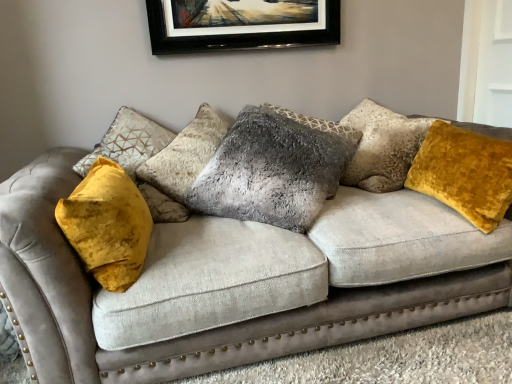
Question: Is fuzzy gray pillow at center, marked as the second pillow in a right-to-left arrangement, shorter than velvet gray couch at center?

Choices:
 (A) yes
 (B) no

Answer: (A)

Question: Does fuzzy gray pillow at center, marked as the second pillow in a right-to-left arrangement, have a lesser width compared to velvet gray couch at center?

Choices:
 (A) no
 (B) yes

Answer: (B)

Question: From a real-world perspective, does fuzzy gray pillow at center, marked as the second pillow in a right-to-left arrangement, sit lower than velvet gray couch at center?

Choices:
 (A) yes
 (B) no

Answer: (B)

Question: Could you tell me if fuzzy gray pillow at center, arranged as the 1th pillow when viewed from the left, is turned towards velvet gray couch at center?

Choices:
 (A) no
 (B) yes

Answer: (B)

Question: Is the position of fuzzy gray pillow at center, marked as the second pillow in a right-to-left arrangement, more distant than that of velvet gray couch at center?

Choices:
 (A) no
 (B) yes

Answer: (B)

Question: Is velvet gray couch at center completely or partially inside fuzzy gray pillow at center, marked as the second pillow in a right-to-left arrangement?

Choices:
 (A) yes
 (B) no

Answer: (B)

Question: Is velvet yellow pillow at right, which ranks as the 2th pillow in left-to-right order, far away from fuzzy gray pillow at center, arranged as the 1th pillow when viewed from the left?

Choices:
 (A) no
 (B) yes

Answer: (A)

Question: Is velvet yellow pillow at right, which ranks as the 2th pillow in left-to-right order, smaller than fuzzy gray pillow at center, marked as the second pillow in a right-to-left arrangement?

Choices:
 (A) no
 (B) yes

Answer: (B)

Question: Is velvet yellow pillow at right, placed as the first pillow when sorted from right to left, bigger than fuzzy gray pillow at center, arranged as the 1th pillow when viewed from the left?

Choices:
 (A) yes
 (B) no

Answer: (B)

Question: Can you confirm if velvet yellow pillow at right, placed as the first pillow when sorted from right to left, is wider than fuzzy gray pillow at center, marked as the second pillow in a right-to-left arrangement?

Choices:
 (A) no
 (B) yes

Answer: (A)

Question: Does velvet yellow pillow at right, placed as the first pillow when sorted from right to left, lie behind fuzzy gray pillow at center, arranged as the 1th pillow when viewed from the left?

Choices:
 (A) no
 (B) yes

Answer: (A)

Question: Is velvet yellow pillow at right, which ranks as the 2th pillow in left-to-right order, completely or partially outside of fuzzy gray pillow at center, marked as the second pillow in a right-to-left arrangement?

Choices:
 (A) no
 (B) yes

Answer: (B)

Question: Is velvet yellow pillow at right, which ranks as the 2th pillow in left-to-right order, wider than velvet gray couch at center?

Choices:
 (A) no
 (B) yes

Answer: (A)